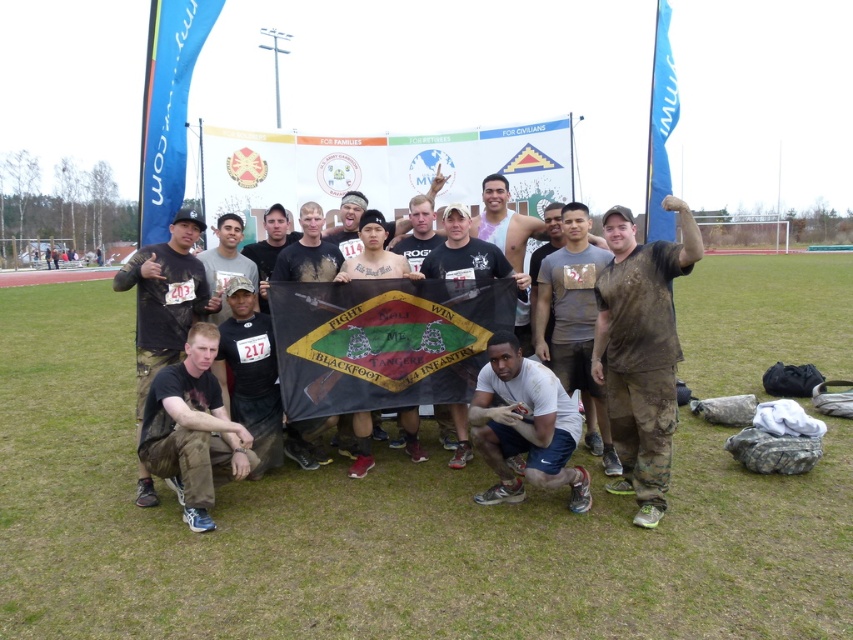
Can you confirm if black matte t-shirt at center is positioned above dark gray fabric shirt at center?

No.

Does black matte t-shirt at center appear on the right side of dark gray fabric shirt at center?

No, black matte t-shirt at center is not to the right of dark gray fabric shirt at center.

Between point (263, 326) and point (404, 433), which one is positioned behind?

The point (404, 433) is behind.

The height and width of the screenshot is (640, 853). In order to click on black matte t-shirt at center in this screenshot , I will do `click(251, 372)`.

Looking at this image, can you confirm if dull brown camouflage pants at right is smaller than matte black cap at center?

Incorrect, dull brown camouflage pants at right is not smaller in size than matte black cap at center.

Between dull brown camouflage pants at right and matte black cap at center, which one has less height?

matte black cap at center is shorter.

Who is more forward, (x=689, y=243) or (x=216, y=246)?

Positioned in front is point (x=689, y=243).

Find the location of a particular element. Image resolution: width=853 pixels, height=640 pixels. dull brown camouflage pants at right is located at coordinates (641, 349).

Does point (302, 550) come behind point (482, 243)?

No, (302, 550) is in front of (482, 243).

This screenshot has height=640, width=853. Find the location of `green grass football field at center`. green grass football field at center is located at coordinates (379, 528).